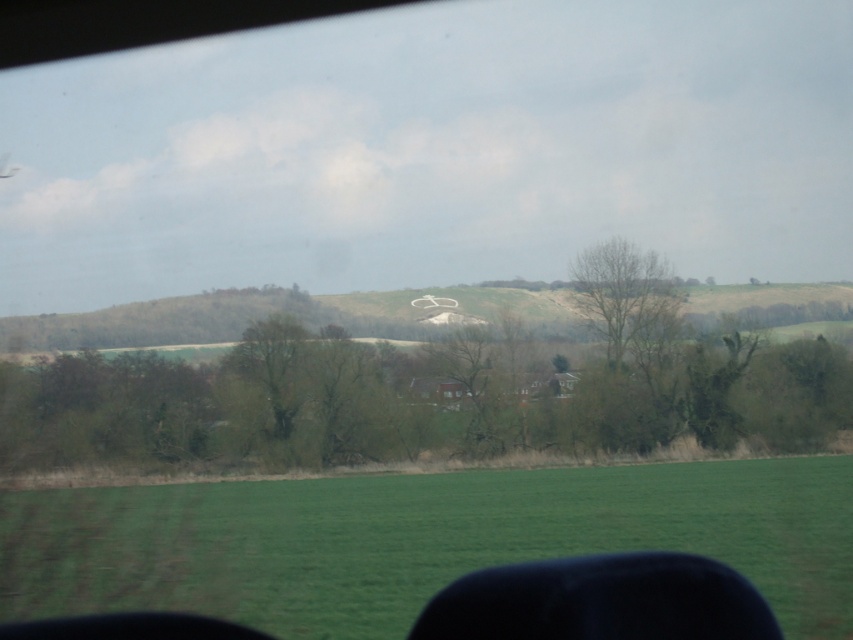
Question: Does green grass at lower center come in front of white chalk hill at center?

Choices:
 (A) yes
 (B) no

Answer: (A)

Question: Which object is farther from the camera taking this photo?

Choices:
 (A) bare wood tree at center
 (B) green grass at lower center
 (C) green leafy tree at center
 (D) white chalk hill at center

Answer: (A)

Question: Which is farther from the green leafy tree at center?

Choices:
 (A) bare wood tree at center
 (B) white chalk hill at center

Answer: (A)

Question: Estimate the real-world distances between objects in this image. Which object is farther from the green leafy tree at center?

Choices:
 (A) white chalk hill at center
 (B) green grass at lower center
 (C) bare wood tree at center

Answer: (B)

Question: Can you confirm if green grass at lower center is positioned to the right of white chalk hill at center?

Choices:
 (A) no
 (B) yes

Answer: (A)

Question: From the image, what is the correct spatial relationship of green grass at lower center in relation to white chalk hill at center?

Choices:
 (A) left
 (B) right

Answer: (A)